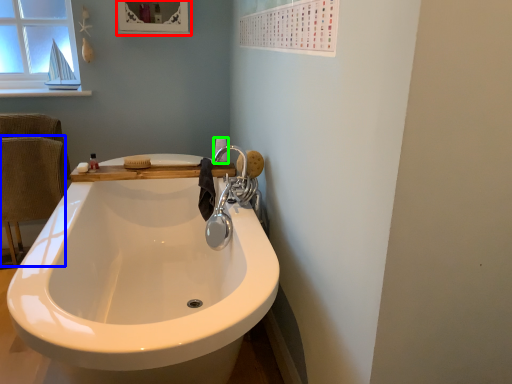
Question: Which object is the farthest from medicine cabinet (highlighted by a red box)? Choose among these: armchair (highlighted by a blue box) or toilet paper (highlighted by a green box).

Choices:
 (A) armchair
 (B) toilet paper

Answer: (A)